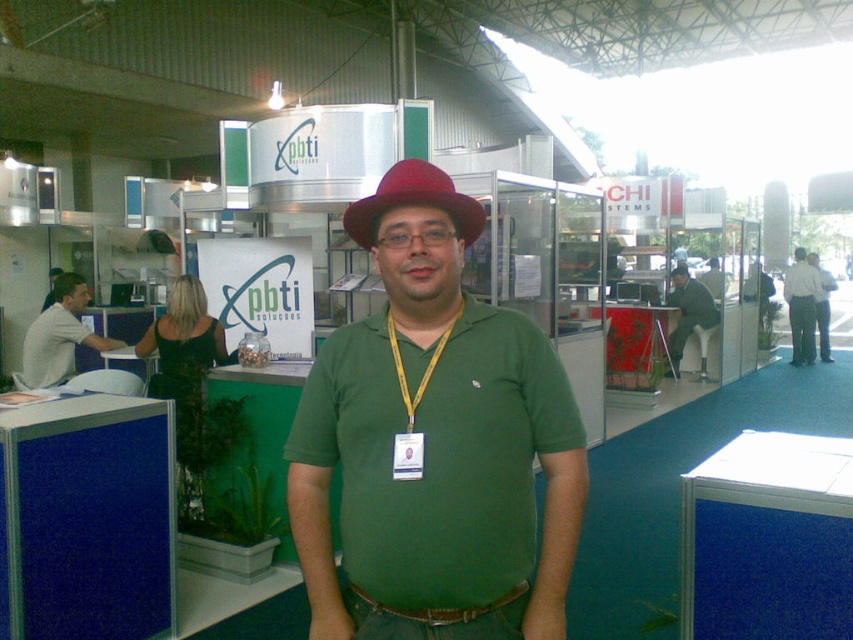
You are a photographer at the event and want to capture a photo of the red felt fedora at center and the white shirt at center. Which object should you focus on first if you want to ensure both are in focus, considering their heights?

The red felt fedora at center has a lesser height compared to the white shirt at center, so you should focus on the white shirt at center first to ensure both are in focus.

You are at the exhibition and need to approach both the white shirt at right and the white shirt at center. Which one should you head towards first if you want to visit them in order from left to right?

The white shirt at right is to the left of the white shirt at center, so you should head towards the white shirt at right first to follow the left to right order.